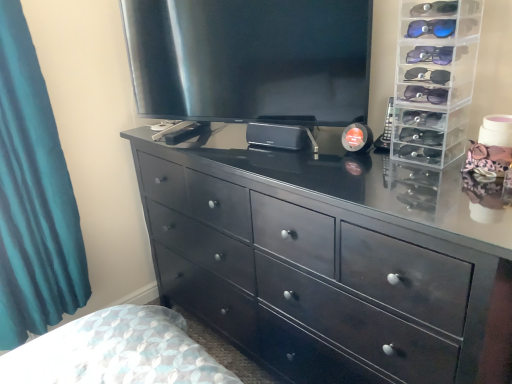
Question: Considering the relative sizes of clear plastic sunglasses organizer at right and black wood chest of drawers at center in the image provided, is clear plastic sunglasses organizer at right taller than black wood chest of drawers at center?

Choices:
 (A) no
 (B) yes

Answer: (A)

Question: Is clear plastic sunglasses organizer at right at the right side of black wood chest of drawers at center?

Choices:
 (A) yes
 (B) no

Answer: (A)

Question: Considering the relative sizes of clear plastic sunglasses organizer at right and black wood chest of drawers at center in the image provided, is clear plastic sunglasses organizer at right shorter than black wood chest of drawers at center?

Choices:
 (A) no
 (B) yes

Answer: (B)

Question: From a real-world perspective, is clear plastic sunglasses organizer at right beneath black wood chest of drawers at center?

Choices:
 (A) yes
 (B) no

Answer: (B)

Question: Does clear plastic sunglasses organizer at right turn towards black wood chest of drawers at center?

Choices:
 (A) no
 (B) yes

Answer: (A)

Question: Considering the relative sizes of clear plastic sunglasses organizer at right and black wood chest of drawers at center in the image provided, is clear plastic sunglasses organizer at right smaller than black wood chest of drawers at center?

Choices:
 (A) yes
 (B) no

Answer: (A)

Question: Is black wood chest of drawers at center wider than satin black tv at upper center?

Choices:
 (A) no
 (B) yes

Answer: (B)

Question: Is black wood chest of drawers at center closer to the viewer compared to satin black tv at upper center?

Choices:
 (A) yes
 (B) no

Answer: (A)

Question: From a real-world perspective, is black wood chest of drawers at center located higher than satin black tv at upper center?

Choices:
 (A) no
 (B) yes

Answer: (A)

Question: Considering the relative positions of black wood chest of drawers at center and satin black tv at upper center in the image provided, is black wood chest of drawers at center behind satin black tv at upper center?

Choices:
 (A) yes
 (B) no

Answer: (B)

Question: Is black wood chest of drawers at center facing towards satin black tv at upper center?

Choices:
 (A) yes
 (B) no

Answer: (B)

Question: Is black wood chest of drawers at center next to satin black tv at upper center and touching it?

Choices:
 (A) yes
 (B) no

Answer: (B)

Question: Considering the relative sizes of satin black tv at upper center and teal fabric curtain at left in the image provided, is satin black tv at upper center taller than teal fabric curtain at left?

Choices:
 (A) yes
 (B) no

Answer: (B)